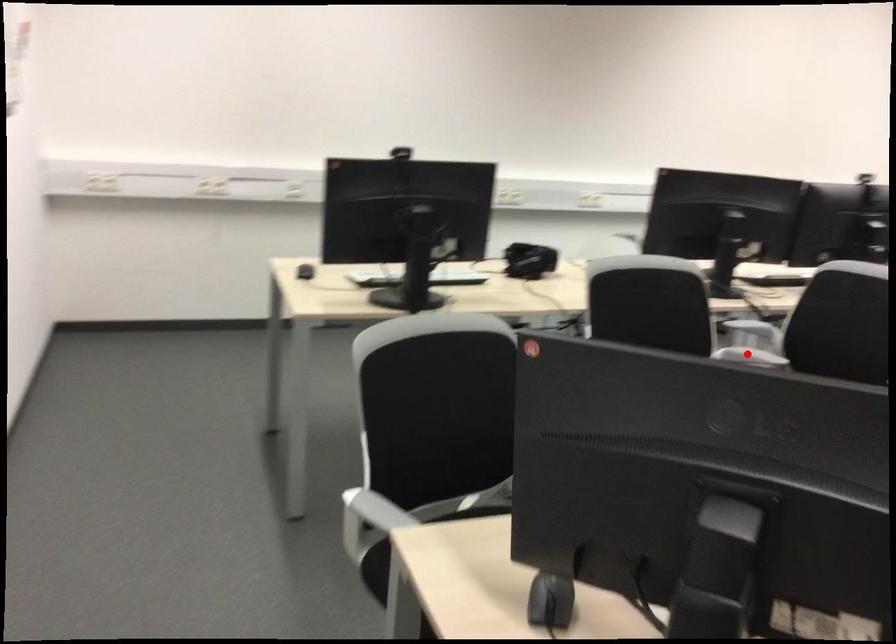
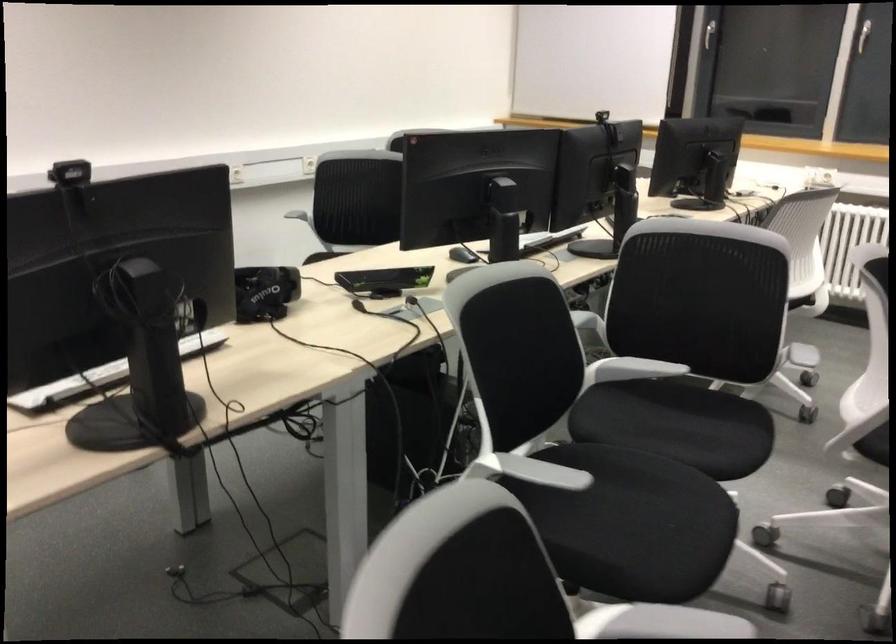
Locate, in the second image, the point that corresponds to the highlighted location in the first image.

(631, 368)